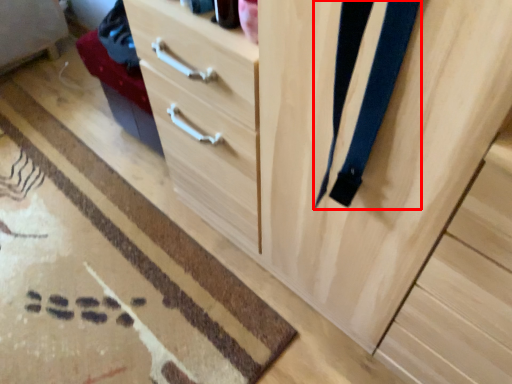
Question: Considering the relative positions of suspenders (annotated by the red box) and doormat in the image provided, where is suspenders (annotated by the red box) located with respect to the staircase?

Choices:
 (A) left
 (B) right

Answer: (B)